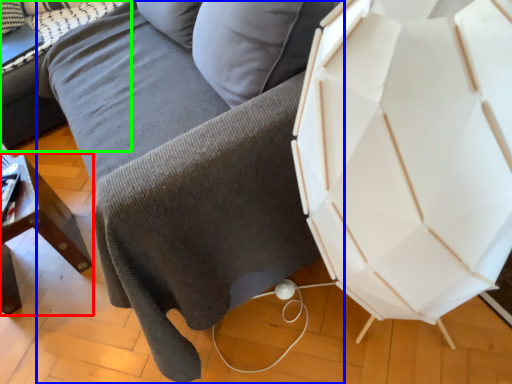
Question: Which is nearer to the furniture (highlighted by a red box)? studio couch (highlighted by a blue box) or table (highlighted by a green box).

Choices:
 (A) studio couch
 (B) table

Answer: (A)